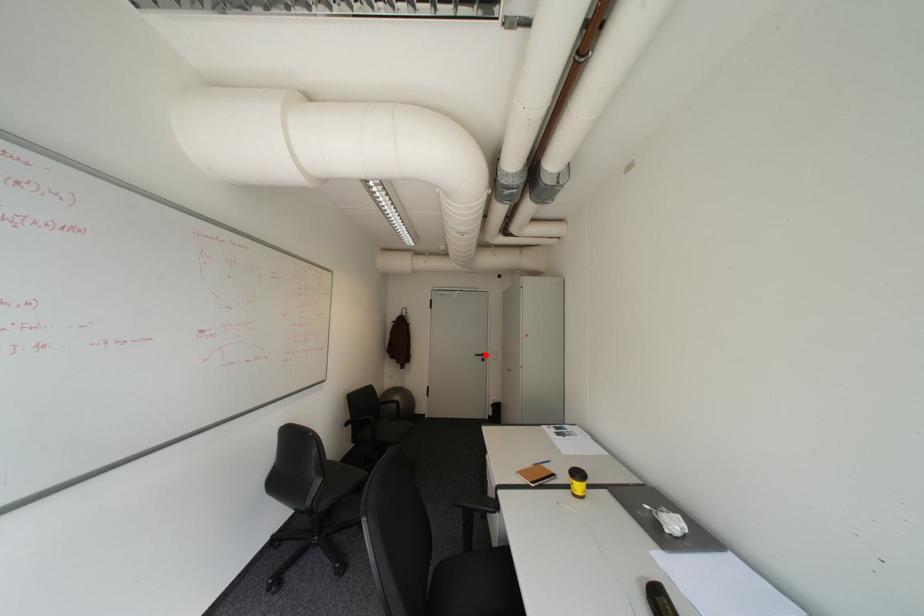
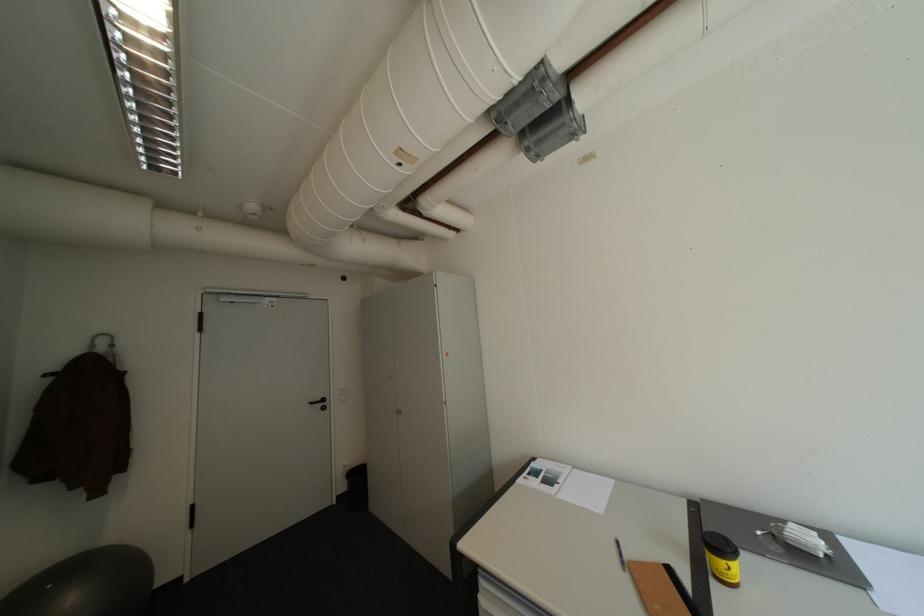
Locate, in the second image, the point that corresponds to the highlighted location in the first image.

(321, 403)